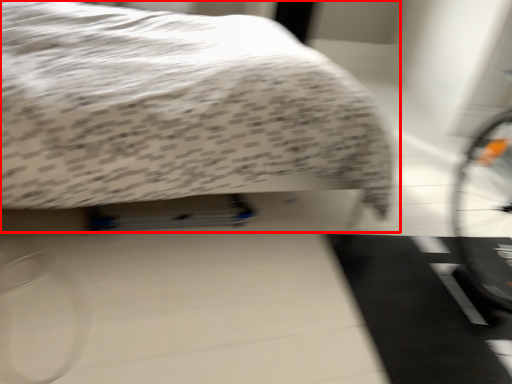
Question: From the image, what is the correct spatial relationship of bed (annotated by the red box) in relation to doormat?

Choices:
 (A) right
 (B) left

Answer: (B)